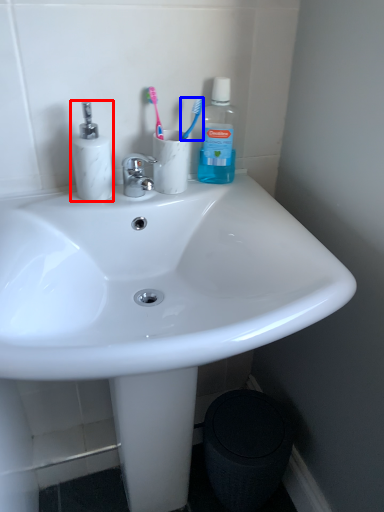
Question: Which object is further to the camera taking this photo, toiletries (highlighted by a red box) or toothbrush (highlighted by a blue box)?

Choices:
 (A) toiletries
 (B) toothbrush

Answer: (B)